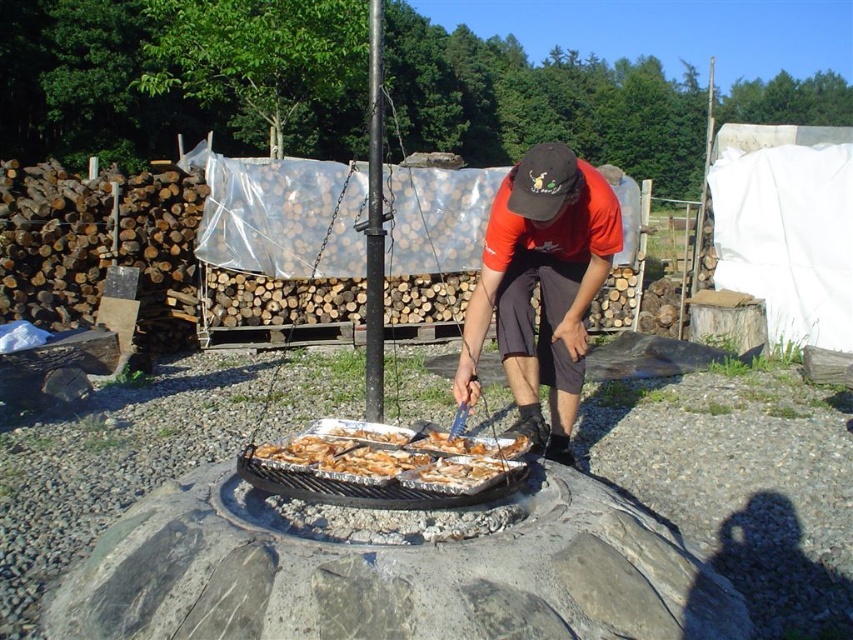
Looking at this image, who is more distant from viewer, (544, 348) or (428, 449)?

Positioned behind is point (544, 348).

Can you confirm if orange t-shirt at center is shorter than golden brown aluminum tray at center?

Incorrect, orange t-shirt at center's height does not fall short of golden brown aluminum tray at center's.

This screenshot has width=853, height=640. Identify the location of orange t-shirt at center. (541, 288).